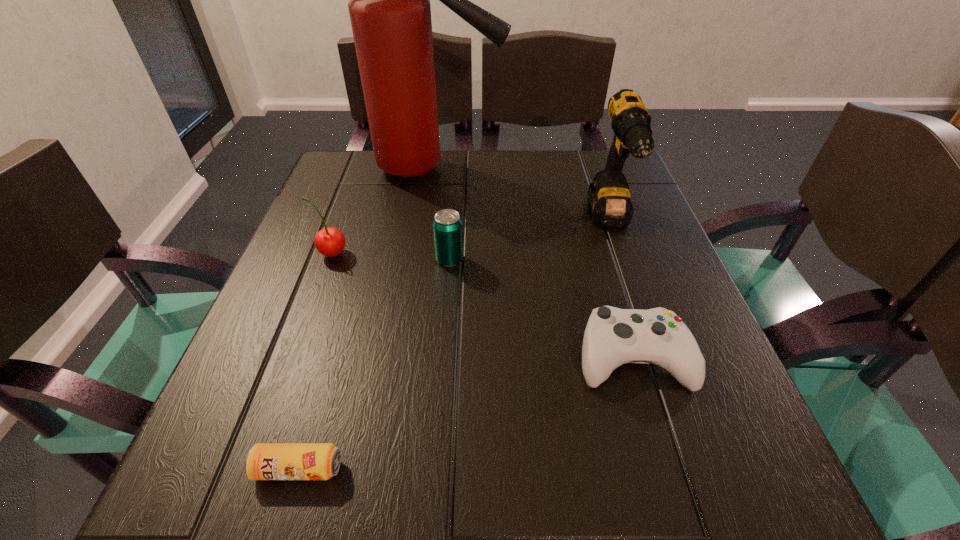
The width and height of the screenshot is (960, 540). Identify the location of vacant region at the right edge of the desktop. (614, 238).

In the image, there is a desktop. Where is `vacant space at the far left corner`? Image resolution: width=960 pixels, height=540 pixels. vacant space at the far left corner is located at coordinates (344, 157).

The height and width of the screenshot is (540, 960). In order to click on unoccupied position between the drill and the fifth farthest object in this screenshot , I will do coord(621,289).

At what (x,y) coordinates should I click in order to perform the action: click on free space between the shorter beer can and the cherry. Please return your answer as a coordinate pair (x, y). This screenshot has width=960, height=540. Looking at the image, I should click on (315, 361).

At what (x,y) coordinates should I click in order to perform the action: click on free space that is in between the cherry and the nearer beer can. Please return your answer as a coordinate pair (x, y). This screenshot has width=960, height=540. Looking at the image, I should click on (315, 361).

Locate an element on the screen. Image resolution: width=960 pixels, height=540 pixels. empty location between the nearest object and the farther beer can is located at coordinates (374, 364).

Locate an element on the screen. vacant space that is in between the fifth farthest object and the tallest object is located at coordinates (530, 263).

At what (x,y) coordinates should I click in order to perform the action: click on free space that is in between the second shortest object and the drill. Please return your answer as a coordinate pair (x, y). Looking at the image, I should click on (621, 289).

This screenshot has width=960, height=540. In order to click on empty location between the drill and the cherry in this screenshot , I will do `click(470, 238)`.

You are a GUI agent. You are given a task and a screenshot of the screen. Output one action in this format:
    pyautogui.click(x=<x>, y=<y>)
    Task: Click on the vacant area that lies between the fifth farthest object and the cherry
    Image resolution: width=960 pixels, height=540 pixels.
    Given the screenshot: What is the action you would take?
    pyautogui.click(x=482, y=306)